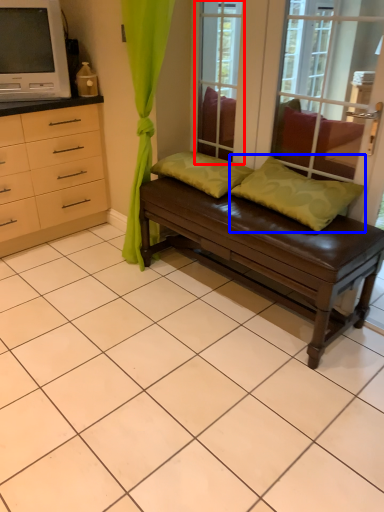
Question: Which point is closer to the camera, window screen (highlighted by a red box) or pillow (highlighted by a blue box)?

Choices:
 (A) window screen
 (B) pillow

Answer: (B)